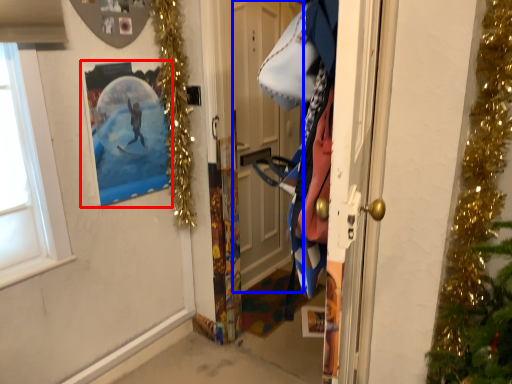
Question: Which point is further to the camera, picture frame (highlighted by a red box) or door (highlighted by a blue box)?

Choices:
 (A) picture frame
 (B) door

Answer: (B)